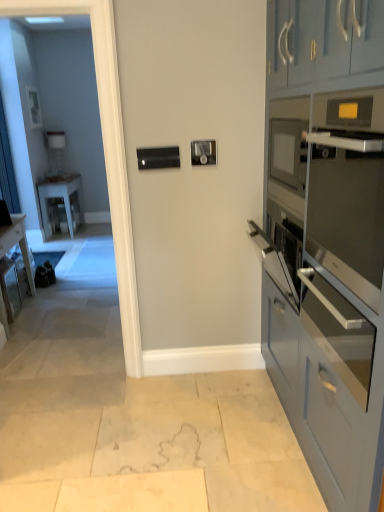
This screenshot has height=512, width=384. I want to click on satin silver oven at right, which is the first oven in top-to-bottom order, so click(349, 200).

The height and width of the screenshot is (512, 384). Describe the element at coordinates (18, 243) in the screenshot. I see `wooden desk at left` at that location.

The width and height of the screenshot is (384, 512). I want to click on satin silver oven at right, which is the second oven from bottom to top, so click(x=349, y=200).

From the image's perspective, between wooden desk at left and white glossy table at left, who is located below?

wooden desk at left, from the image's perspective.

Is wooden desk at left facing away from white glossy table at left?

No, white glossy table at left is not at the back of wooden desk at left.

Does wooden desk at left have a greater width compared to white glossy table at left?

No, wooden desk at left is not wider than white glossy table at left.

Does wooden desk at left turn towards satin silver oven at right, the 1th oven positioned from the bottom?

No, wooden desk at left does not turn towards satin silver oven at right, the 1th oven positioned from the bottom.

Is wooden desk at left bigger than satin silver oven at right, which is the second oven in top-to-bottom order?

Yes.

From the image's perspective, is wooden desk at left located above satin silver oven at right, the 1th oven positioned from the bottom?

Yes, from the image's perspective, wooden desk at left is on top of satin silver oven at right, the 1th oven positioned from the bottom.

Considering the relative sizes of wooden desk at left and satin silver oven at right, the 1th oven positioned from the bottom, in the image provided, is wooden desk at left shorter than satin silver oven at right, the 1th oven positioned from the bottom,?

No.

Find the location of a particular element. Image resolution: width=384 pixels, height=512 pixels. table below the satin silver oven at right, which is the first oven in top-to-bottom order (from a real-world perspective) is located at coordinates (60, 197).

Does point (336, 185) lie behind point (80, 198)?

No.

Considering the relative sizes of satin silver oven at right, which is the second oven from bottom to top, and white glossy table at left in the image provided, is satin silver oven at right, which is the second oven from bottom to top, smaller than white glossy table at left?

Indeed, satin silver oven at right, which is the second oven from bottom to top, has a smaller size compared to white glossy table at left.

How different are the orientations of white glossy table at left and wooden desk at left in degrees?

The facing directions of white glossy table at left and wooden desk at left are 1.59 degrees apart.

Do you think white glossy table at left is within wooden desk at left, or outside of it?

white glossy table at left is spatially situated outside wooden desk at left.

Is white glossy table at left shorter than wooden desk at left?

Incorrect, the height of white glossy table at left does not fall short of that of wooden desk at left.

Does white glossy table at left have a smaller size compared to wooden desk at left?

Actually, white glossy table at left might be larger than wooden desk at left.

Considering the points (316, 8) and (112, 114), which point is in front, point (316, 8) or point (112, 114)?

The point (316, 8) is closer to the camera.

From the image's perspective, relative to transparent glass door at left, is matte blue cabinets at right above or below?

From the image's perspective, matte blue cabinets at right appears below transparent glass door at left.

Is matte blue cabinets at right positioned far away from transparent glass door at left?

Yes, matte blue cabinets at right and transparent glass door at left are located far from each other.

Is satin silver oven at right, which is the first oven in top-to-bottom order, aimed at satin silver oven at right, the 1th oven positioned from the bottom?

No, satin silver oven at right, which is the first oven in top-to-bottom order, is not turned towards satin silver oven at right, the 1th oven positioned from the bottom.

Based on their positions, is satin silver oven at right, which is the first oven in top-to-bottom order, located to the left or right of satin silver oven at right, the 1th oven positioned from the bottom?

satin silver oven at right, which is the first oven in top-to-bottom order, is to the left of satin silver oven at right, the 1th oven positioned from the bottom.

Could you measure the distance between satin silver oven at right, which is the first oven in top-to-bottom order, and wooden desk at left?

satin silver oven at right, which is the first oven in top-to-bottom order, is 9.61 feet from wooden desk at left.

Who is smaller, satin silver oven at right, which is the second oven from bottom to top, or wooden desk at left?

satin silver oven at right, which is the second oven from bottom to top.

From a real-world perspective, relative to wooden desk at left, is satin silver oven at right, which is the second oven from bottom to top, vertically above or below?

In terms of real-world spatial position, satin silver oven at right, which is the second oven from bottom to top, is above wooden desk at left.

Locate an element on the screen. This screenshot has width=384, height=512. table behind the wooden desk at left is located at coordinates (60, 197).

Where is `desk on the left of satin silver oven at right, which is the second oven in top-to-bottom order`? desk on the left of satin silver oven at right, which is the second oven in top-to-bottom order is located at coordinates (18, 243).

Looking at this image, looking at the image, which one is located further to wooden desk at left, matte blue cabinets at right or white glossy table at left?

The object further to wooden desk at left is matte blue cabinets at right.

Which object lies further to the anchor point white glossy table at left, transparent glass door at left or matte blue cabinets at right?

The object further to white glossy table at left is matte blue cabinets at right.

When comparing their distances from satin silver oven at right, the 1th oven positioned from the bottom, does satin silver oven at right, which is the first oven in top-to-bottom order, or wooden desk at left seem further?

The object further to satin silver oven at right, the 1th oven positioned from the bottom, is wooden desk at left.

Looking at the image, which one is located closer to transparent glass door at left, white glossy table at left or satin silver oven at right, which is the first oven in top-to-bottom order?

The object closer to transparent glass door at left is satin silver oven at right, which is the first oven in top-to-bottom order.

When comparing their distances from transparent glass door at left, does satin silver oven at right, which is the second oven in top-to-bottom order, or wooden desk at left seem further?

wooden desk at left is further to transparent glass door at left.

From the image, which object appears to be farther from satin silver oven at right, which is the second oven in top-to-bottom order, white glossy table at left or satin silver oven at right, which is the second oven from bottom to top?

white glossy table at left.

Looking at the image, which one is located closer to matte blue cabinets at right, satin silver oven at right, which is the second oven in top-to-bottom order, or transparent glass door at left?

satin silver oven at right, which is the second oven in top-to-bottom order, lies closer to matte blue cabinets at right than the other object.

From the image, which object appears to be farther from transparent glass door at left, satin silver oven at right, which is the first oven in top-to-bottom order, or white glossy table at left?

Among the two, white glossy table at left is located further to transparent glass door at left.

The image size is (384, 512). Identify the location of glass door located between wooden desk at left and satin silver oven at right, which is the second oven in top-to-bottom order, in the left-right direction. (106, 152).

The image size is (384, 512). Find the location of `desk positioned between matte blue cabinets at right and white glossy table at left from near to far`. desk positioned between matte blue cabinets at right and white glossy table at left from near to far is located at coordinates (18, 243).

Locate an element on the screen. The height and width of the screenshot is (512, 384). glass door situated between wooden desk at left and matte blue cabinets at right from left to right is located at coordinates (106, 152).

Find the location of a particular element. The height and width of the screenshot is (512, 384). desk between transparent glass door at left and white glossy table at left from front to back is located at coordinates (18, 243).